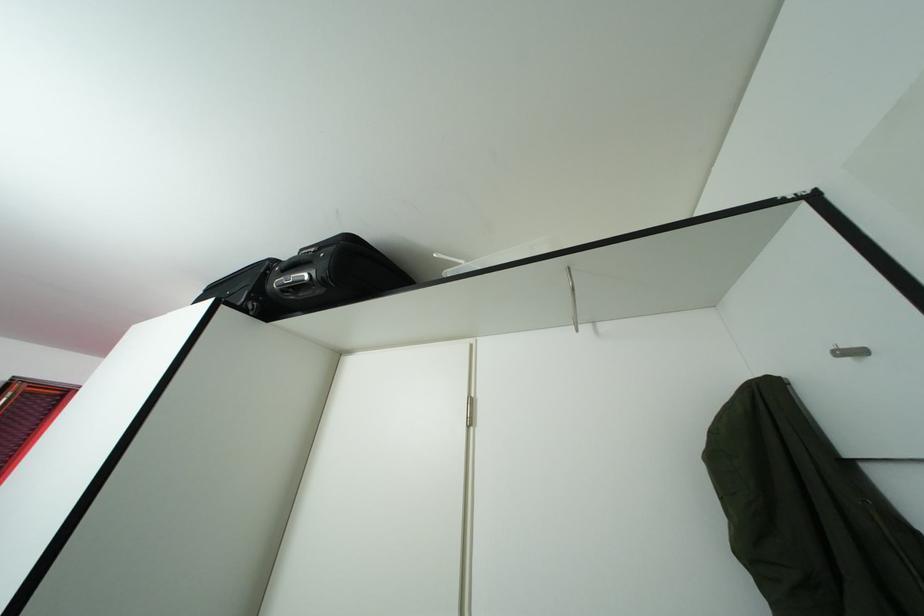
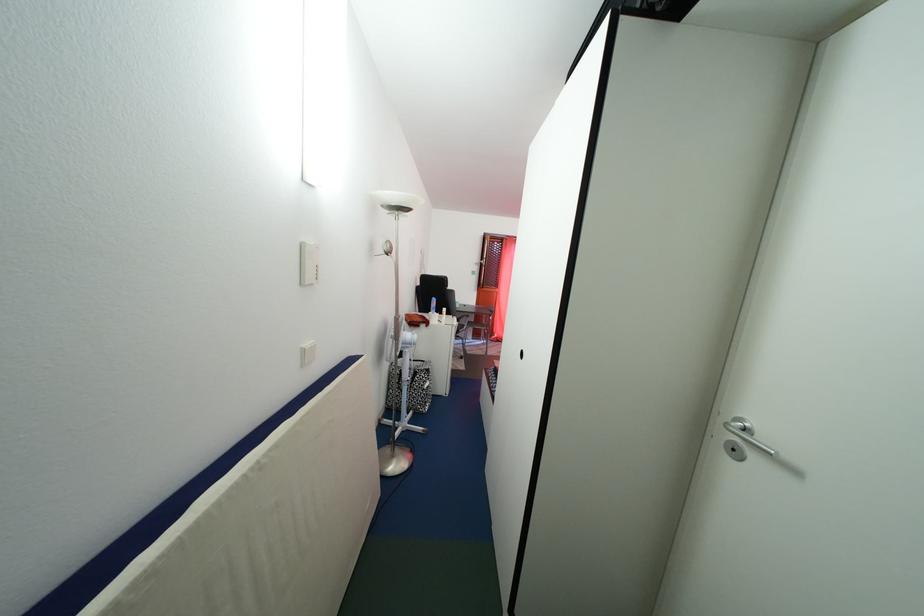
The images are taken continuously from a first-person perspective. In which direction is your viewpoint rotating?

The rotation direction of the camera is left-down.